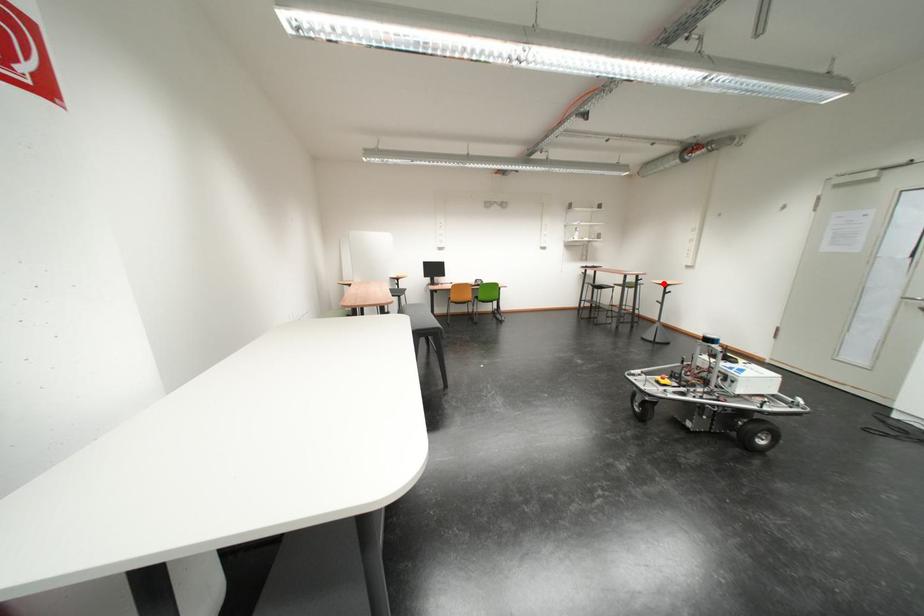
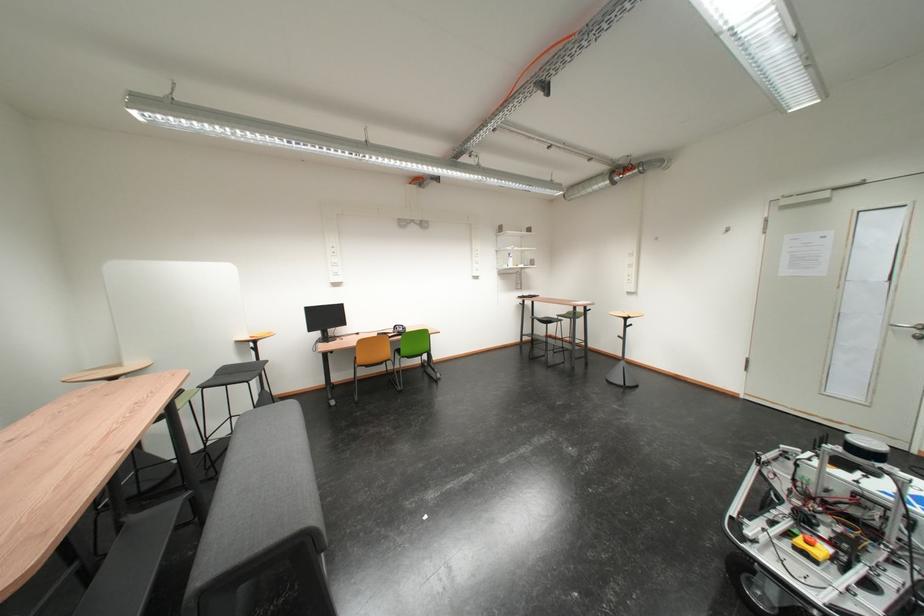
Locate, in the second image, the point that corresponds to the highlighted location in the first image.

(622, 315)